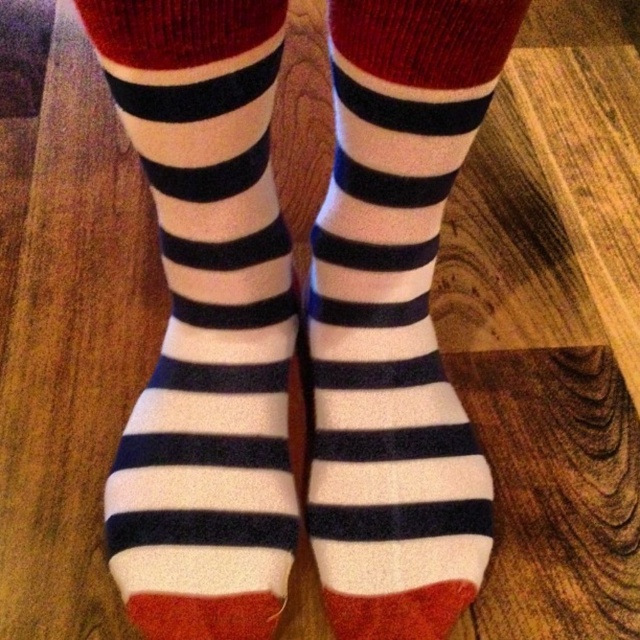
Question: Which point appears farthest from the camera in this image?

Choices:
 (A) (417, 330)
 (B) (404, 150)

Answer: (A)

Question: Can you confirm if white/soft cotton socks at center is positioned below white soft socks at center?

Choices:
 (A) no
 (B) yes

Answer: (A)

Question: Which object is positioned farthest from the white/soft cotton socks at center?

Choices:
 (A) white soft socks at center
 (B) white woolen socks at center

Answer: (A)

Question: Which of the following is the closest to the observer?

Choices:
 (A) click(x=404, y=612)
 (B) click(x=188, y=515)
 (C) click(x=241, y=180)

Answer: (C)

Question: Is white woolen socks at center bigger than white soft socks at center?

Choices:
 (A) no
 (B) yes

Answer: (B)

Question: In this image, where is white woolen socks at center located relative to white/soft cotton socks at center?

Choices:
 (A) below
 (B) above

Answer: (A)